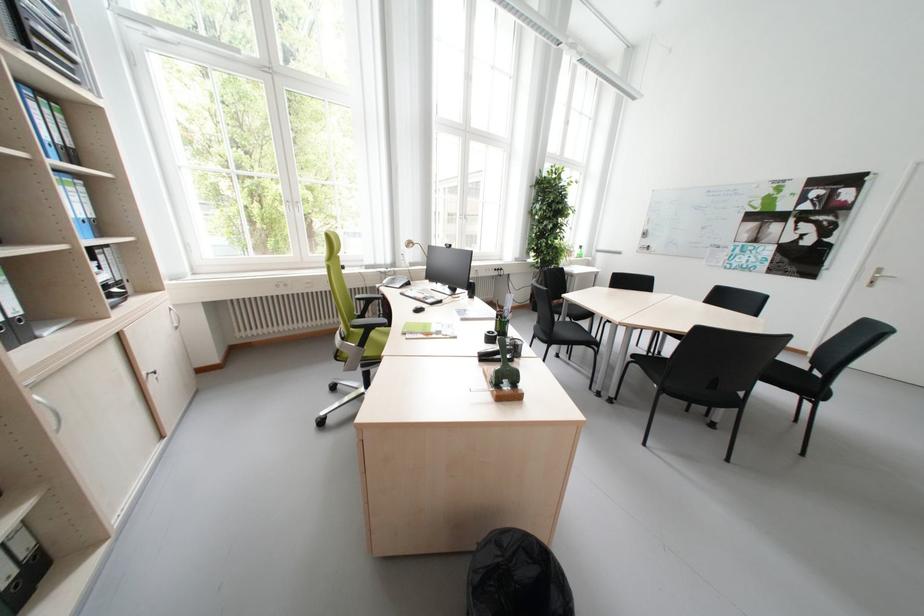
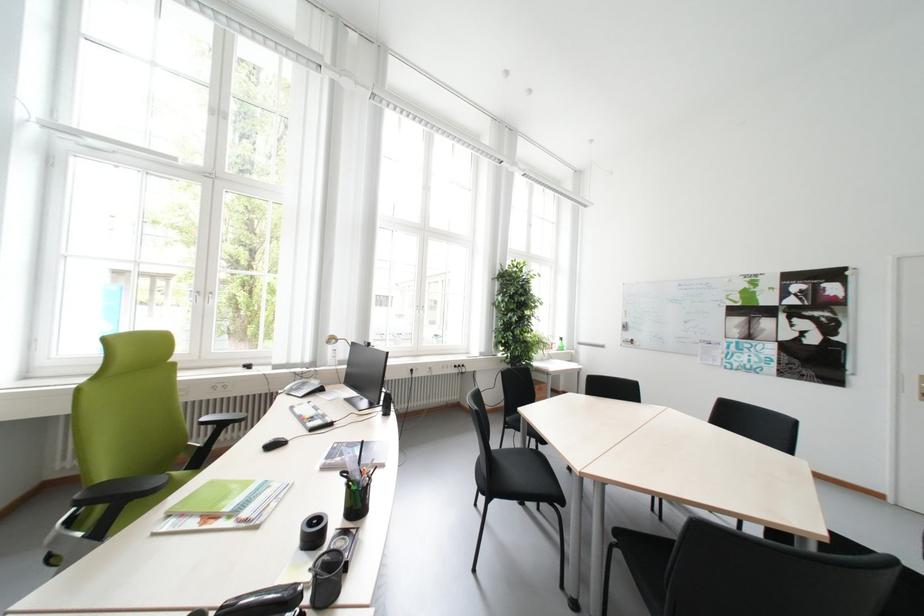
In the second image, find the point that corresponds to the point at 639,245 in the first image.

(621, 338)